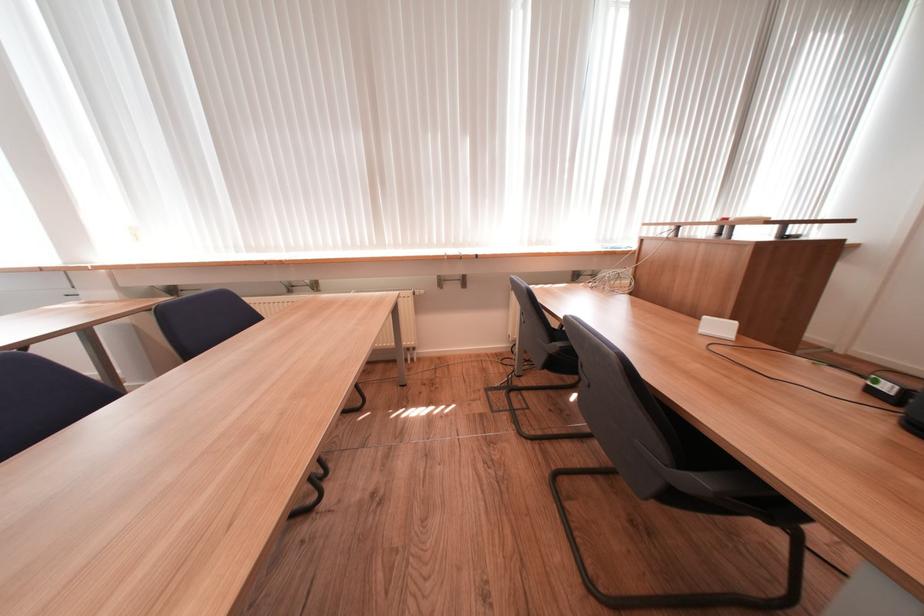
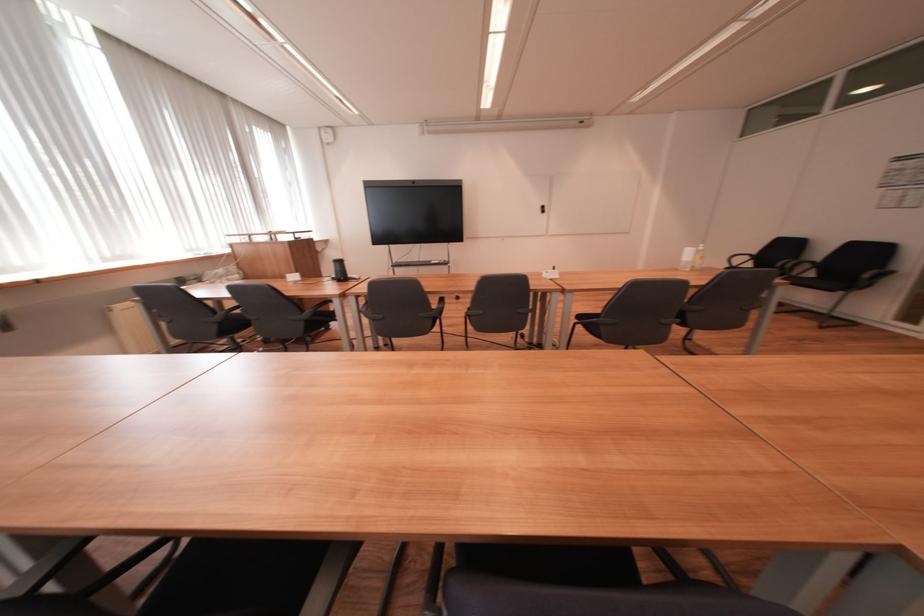
In the second image, find the point that corresponds to the point at 895,389 in the first image.

(343, 278)